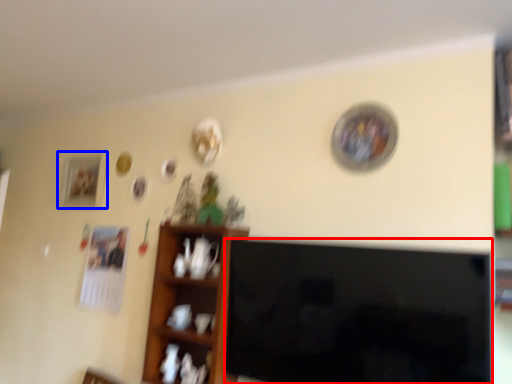
Question: Which object appears farthest to the camera in this image, television (highlighted by a red box) or picture frame (highlighted by a blue box)?

Choices:
 (A) television
 (B) picture frame

Answer: (B)